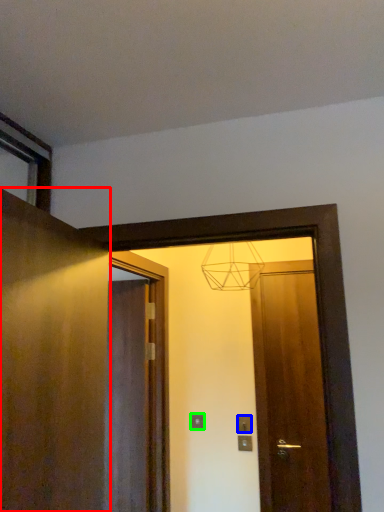
Question: Based on their relative distances, which object is nearer to door (highlighted by a red box)? Choose from electric outlet (highlighted by a blue box) and electric outlet (highlighted by a green box).

Choices:
 (A) electric outlet
 (B) electric outlet

Answer: (B)